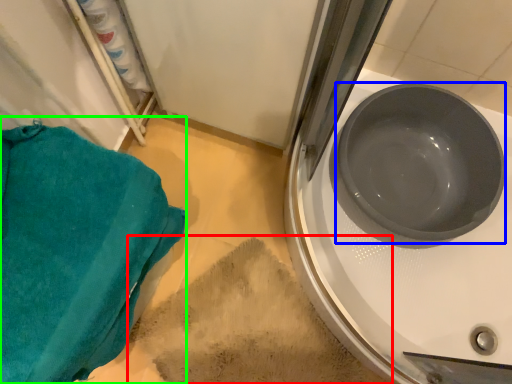
Question: Which object is the closest to the dirt (highlighted by a red box)? Choose among these: basin (highlighted by a blue box) or towel/napkin (highlighted by a green box).

Choices:
 (A) basin
 (B) towel/napkin

Answer: (B)